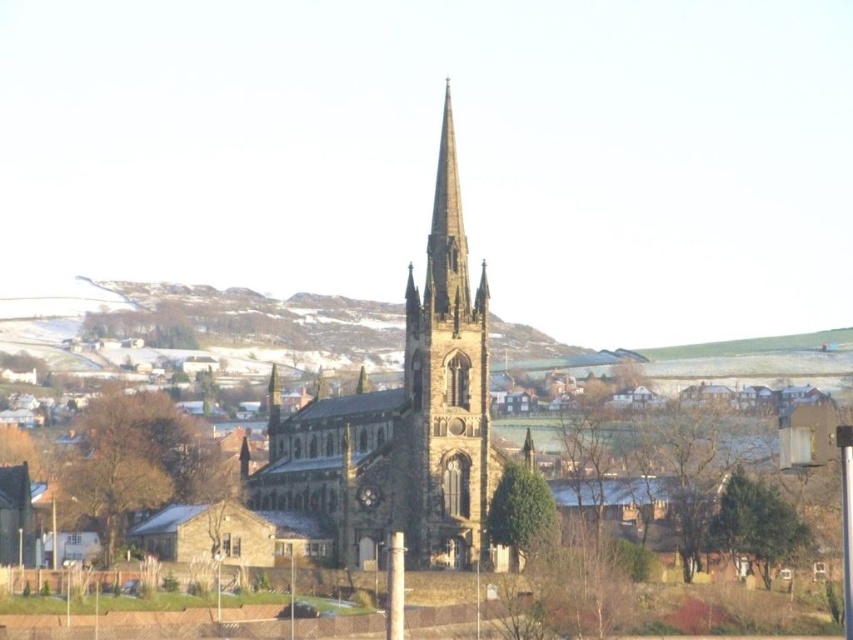
Does brown stone church at center appear under brown stone tower at center?

Correct, brown stone church at center is located below brown stone tower at center.

Which of these two, brown stone church at center or brown stone tower at center, stands shorter?

Standing shorter between the two is brown stone tower at center.

The image size is (853, 640). Describe the element at coordinates (401, 422) in the screenshot. I see `brown stone church at center` at that location.

Where is `brown stone church at center`? brown stone church at center is located at coordinates (401, 422).